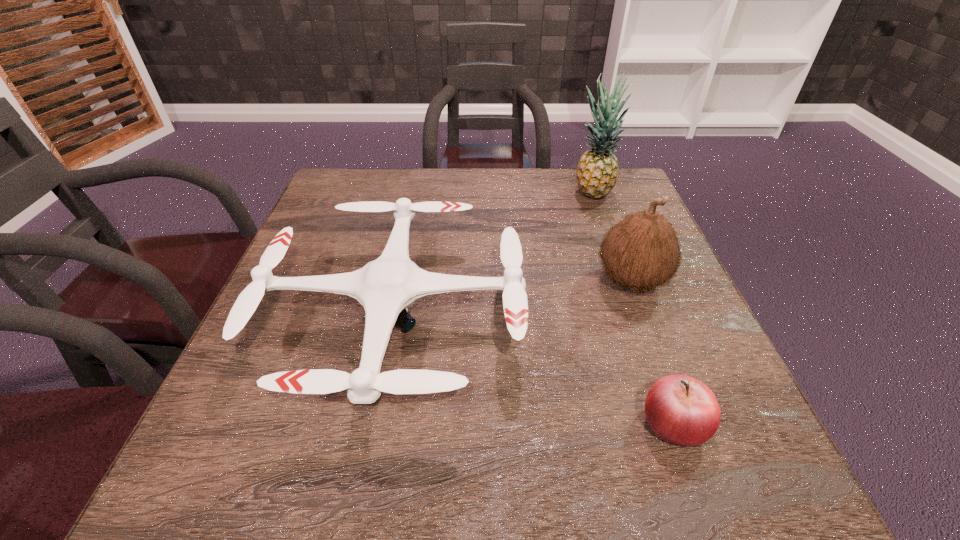
Find the location of a particular element. vacant region between the apple and the coconut is located at coordinates (653, 352).

Find the location of a particular element. free space between the coconut and the apple is located at coordinates (653, 352).

At what (x,y) coordinates should I click in order to perform the action: click on vacant space in between the drone and the tallest object. Please return your answer as a coordinate pair (x, y). Looking at the image, I should click on (493, 256).

Image resolution: width=960 pixels, height=540 pixels. In order to click on the second closest object to the shortest object in this screenshot , I will do `click(642, 251)`.

Image resolution: width=960 pixels, height=540 pixels. In order to click on object that is the second closest one to the third shortest object in this screenshot , I will do `click(682, 410)`.

You are a GUI agent. You are given a task and a screenshot of the screen. Output one action in this format:
    pyautogui.click(x=<x>, y=<y>)
    Task: Click on the free space that satisfies the following two spatial constraints: 1. with the camera attached at the bottom of the drone; 2. on the back side of the apple
    
    Given the screenshot: What is the action you would take?
    pyautogui.click(x=375, y=423)

Find the location of a particular element. free point that satisfies the following two spatial constraints: 1. on the back side of the apple; 2. with the camera attached at the bottom of the leftmost object is located at coordinates (636, 319).

Locate an element on the screen. This screenshot has height=540, width=960. free spot that satisfies the following two spatial constraints: 1. on the back side of the apple; 2. with the camera attached at the bottom of the leftmost object is located at coordinates (x=636, y=319).